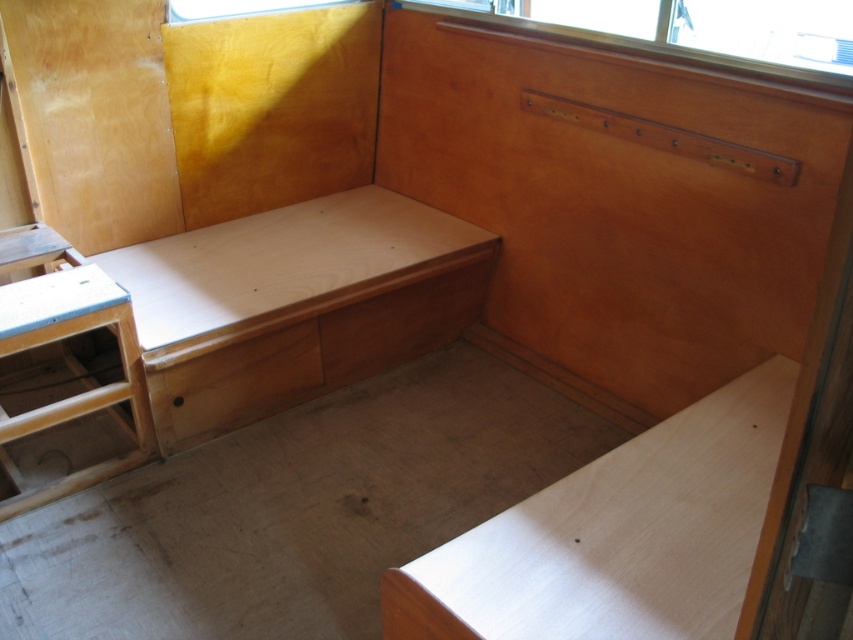
Can you confirm if natural wood stool at lower left is smaller than natural wood drawer at center?

No.

The image size is (853, 640). What do you see at coordinates (83, 380) in the screenshot?
I see `natural wood stool at lower left` at bounding box center [83, 380].

What are the coordinates of `natural wood stool at lower left` in the screenshot? It's located at (83, 380).

At what (x,y) coordinates should I click in order to perform the action: click on light brown wood table at lower right. Please return your answer as a coordinate pair (x, y). Looking at the image, I should click on (618, 536).

Is the position of light brown wood table at lower right more distant than that of natural wood drawer at center?

No, it is not.

Between point (404, 564) and point (300, 346), which one is positioned in front?

Point (404, 564)

Image resolution: width=853 pixels, height=640 pixels. In order to click on light brown wood table at lower right in this screenshot , I will do `click(618, 536)`.

Can you confirm if natural wood bench at center is taller than natural wood drawer at center?

Indeed, natural wood bench at center has a greater height compared to natural wood drawer at center.

Based on the photo, how distant is natural wood bench at center from natural wood drawer at center?

natural wood bench at center and natural wood drawer at center are 7.17 inches apart.

Who is more distant from viewer, (374,273) or (277,332)?

Positioned behind is point (374,273).

You are a GUI agent. You are given a task and a screenshot of the screen. Output one action in this format:
    pyautogui.click(x=<x>, y=<y>)
    Task: Click on the natural wood bench at center
    
    Given the screenshot: What is the action you would take?
    pyautogui.click(x=294, y=305)